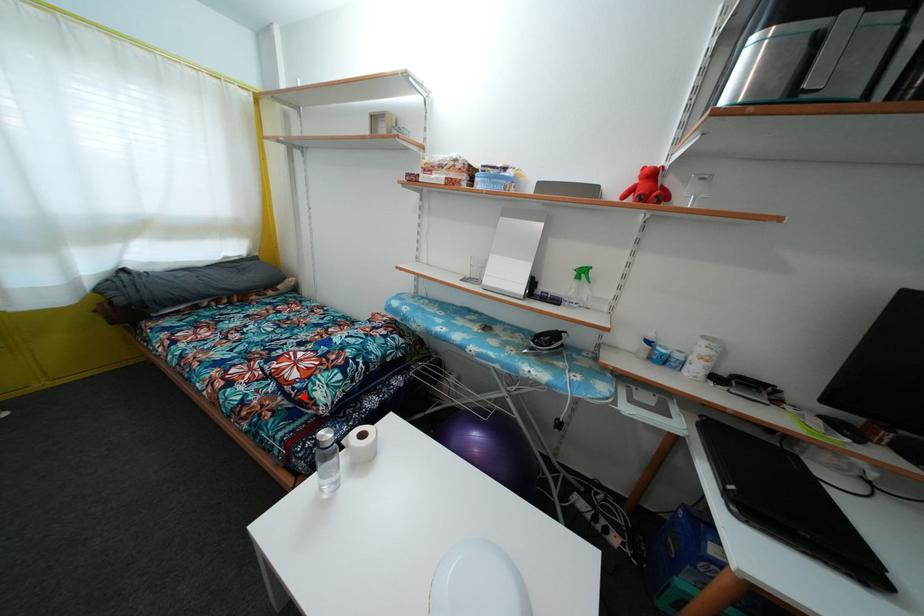
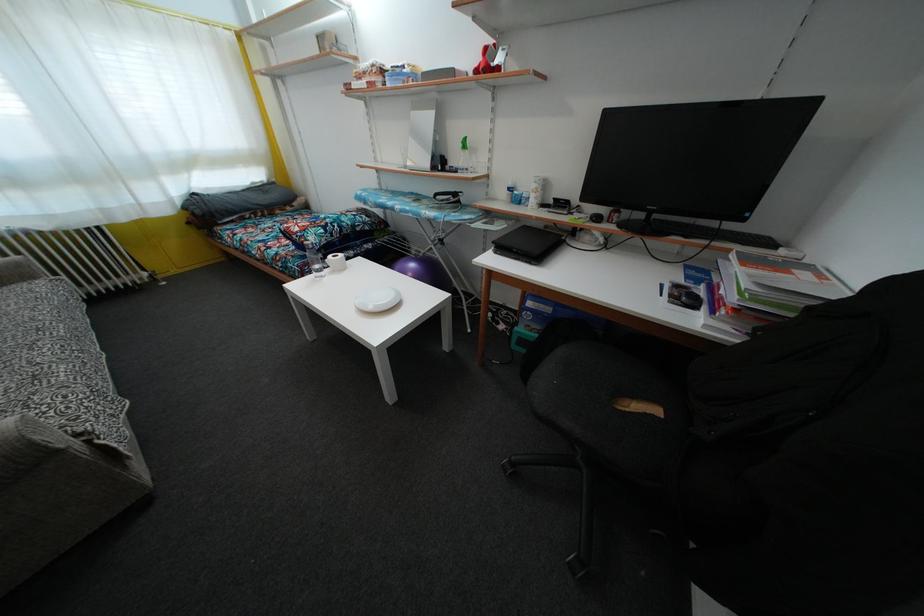
Question: A red point is marked in image1. In image2, is the corresponding 3D point closer to the camera or farther? Reply with the corresponding letter.

Choices:
 (A) The corresponding 3D point is closer.
 (B) The corresponding 3D point is farther.

Answer: (A)